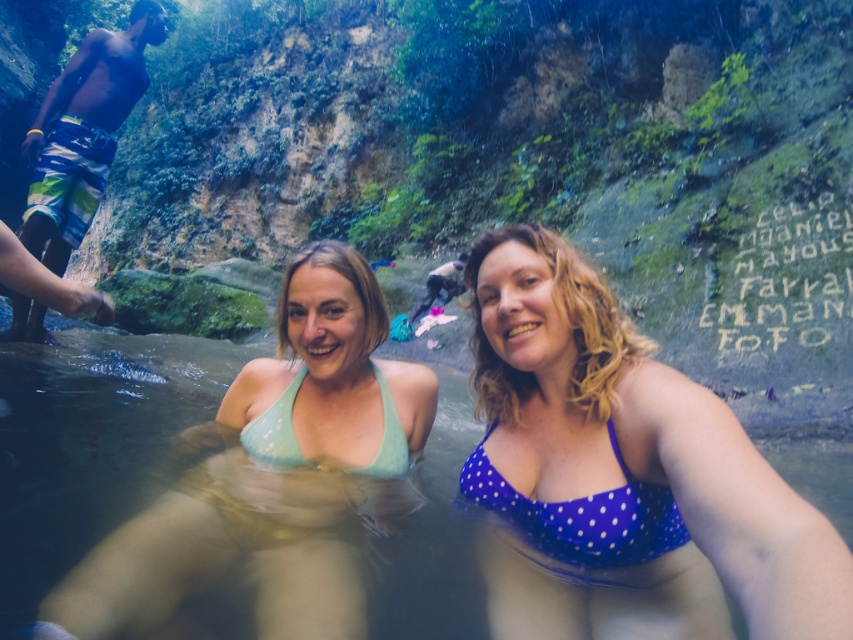
Question: Which object is farther from the camera taking this photo?

Choices:
 (A) blue polka dot bikini top at center
 (B) light blue polka dot bikini top at center
 (C) multicolored striped shorts at left

Answer: (C)

Question: In this image, where is blue polka dot bikini at center located relative to matte green bikini top at center?

Choices:
 (A) below
 (B) above

Answer: (B)

Question: Which point is farther to the camera?

Choices:
 (A) (55, 102)
 (B) (274, 625)
 (C) (387, 442)
 (D) (607, 436)

Answer: (A)

Question: Among these objects, which one is farthest from the camera?

Choices:
 (A) multicolored striped shorts at left
 (B) blue polka dot bikini at center
 (C) blue polka dot bikini top at center
 (D) light blue polka dot bikini top at center

Answer: (A)

Question: Does matte green bikini top at center appear on the left side of multicolored striped shorts at left?

Choices:
 (A) no
 (B) yes

Answer: (A)

Question: Considering the relative positions of blue polka dot bikini at center and multicolored striped shorts at left in the image provided, where is blue polka dot bikini at center located with respect to multicolored striped shorts at left?

Choices:
 (A) below
 (B) above

Answer: (A)